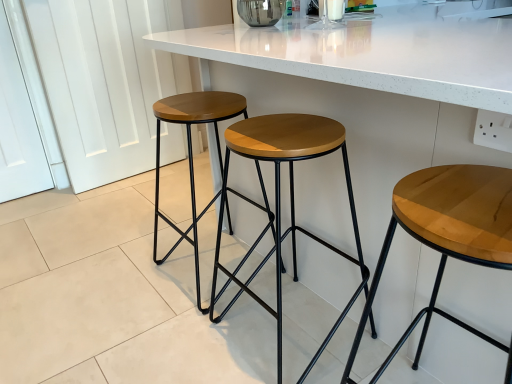
Find the location of `free space in front of wooden/matte stool at center, the first stool when ordered from left to right`. free space in front of wooden/matte stool at center, the first stool when ordered from left to right is located at coordinates (174, 337).